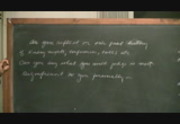
Find the location of `fourth line of writing on chalkboard`. fourth line of writing on chalkboard is located at coordinates (33, 74), (73, 74), (81, 74), (105, 75).